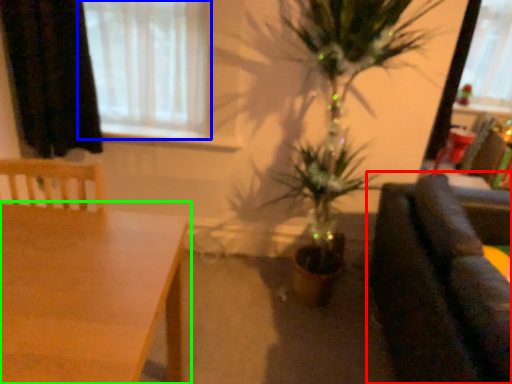
Question: Which object is the closest to the studio couch (highlighted by a red box)? Choose among these: window (highlighted by a blue box) or table (highlighted by a green box).

Choices:
 (A) window
 (B) table

Answer: (B)